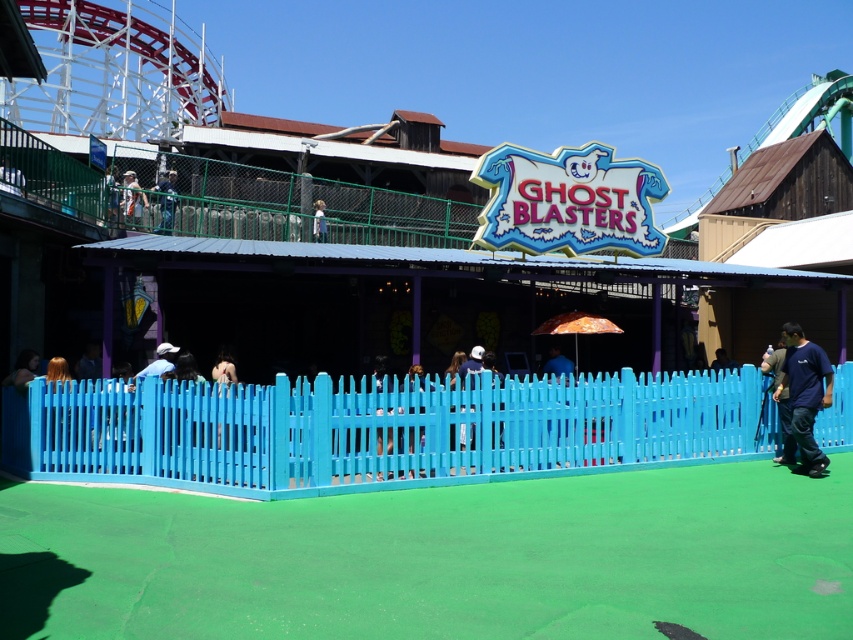
Based on the photo, you are at the amusement park and see two people wearing shirts. One is wearing a blue fabric shirt at upper center and the other a tan fabric shirt at upper left. From your perspective, which shirt is positioned more to the left?

The blue fabric shirt at upper center is positioned more to the left than the tan fabric shirt at upper left.

You are at the amusement park and see two people wearing shirts. One is wearing a blue fabric shirt at upper center and the other a tan fabric shirt at upper left. Which shirt do you think is larger?

The blue fabric shirt at upper center is bigger than the tan fabric shirt at upper left, so the blue fabric shirt at upper center is larger.